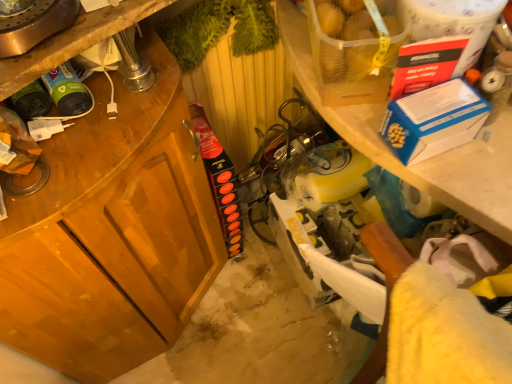
Question: From a real-world perspective, is blue cardboard box at upper right positioned over wooden cabinet at left based on gravity?

Choices:
 (A) no
 (B) yes

Answer: (B)

Question: From a real-world perspective, is blue cardboard box at upper right physically below wooden cabinet at left?

Choices:
 (A) yes
 (B) no

Answer: (B)

Question: Is blue cardboard box at upper right positioned beyond the bounds of wooden cabinet at left?

Choices:
 (A) yes
 (B) no

Answer: (A)

Question: Is blue cardboard box at upper right bigger than wooden cabinet at left?

Choices:
 (A) no
 (B) yes

Answer: (A)

Question: From the image's perspective, is blue cardboard box at upper right located beneath wooden cabinet at left?

Choices:
 (A) no
 (B) yes

Answer: (A)

Question: Is blue cardboard box at upper right taller than wooden cabinet at left?

Choices:
 (A) yes
 (B) no

Answer: (B)

Question: Is white plastic shelf at upper right further to camera compared to wooden cabinet at left?

Choices:
 (A) yes
 (B) no

Answer: (A)

Question: Is white plastic shelf at upper right completely or partially outside of wooden cabinet at left?

Choices:
 (A) no
 (B) yes

Answer: (B)

Question: Does white plastic shelf at upper right lie in front of wooden cabinet at left?

Choices:
 (A) no
 (B) yes

Answer: (A)

Question: Are white plastic shelf at upper right and wooden cabinet at left located far from each other?

Choices:
 (A) no
 (B) yes

Answer: (A)

Question: From a real-world perspective, is white plastic shelf at upper right located beneath wooden cabinet at left?

Choices:
 (A) yes
 (B) no

Answer: (B)

Question: From a real-world perspective, is white plastic shelf at upper right positioned over wooden cabinet at left based on gravity?

Choices:
 (A) yes
 (B) no

Answer: (A)

Question: Is the depth of translucent plastic bag of potatoes at upper right less than that of white plastic shelf at upper right?

Choices:
 (A) yes
 (B) no

Answer: (A)